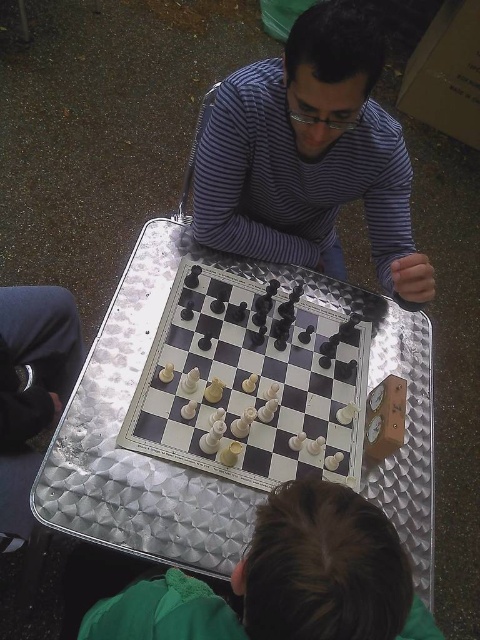
Which is more to the right, striped fabric shirt at upper center or white plastic chessboard at center?

Positioned to the right is striped fabric shirt at upper center.

Does striped fabric shirt at upper center appear under white plastic chessboard at center?

No.

This screenshot has height=640, width=480. Identify the location of striped fabric shirt at upper center. (310, 156).

Where is `striped fabric shirt at upper center`? The width and height of the screenshot is (480, 640). striped fabric shirt at upper center is located at coordinates (310, 156).

Can you confirm if metallic chessboard at center is thinner than striped fabric shirt at upper center?

No.

Does point (124, 490) come closer to viewer compared to point (309, 154)?

That is True.

Is point (132, 308) positioned in front of point (307, 81)?

No, (132, 308) is further to viewer.

Locate an element on the screen. The image size is (480, 640). metallic chessboard at center is located at coordinates (203, 472).

Between striped fabric shirt at upper center and green fabric at lower center, which one appears on the right side from the viewer's perspective?

Positioned to the right is striped fabric shirt at upper center.

Is striped fabric shirt at upper center wider than green fabric at lower center?

Incorrect, striped fabric shirt at upper center's width does not surpass green fabric at lower center's.

Who is more forward, (337, 88) or (406, 588)?

Point (406, 588) is in front.

This screenshot has height=640, width=480. What are the coordinates of `striped fabric shirt at upper center` in the screenshot? It's located at point(310,156).